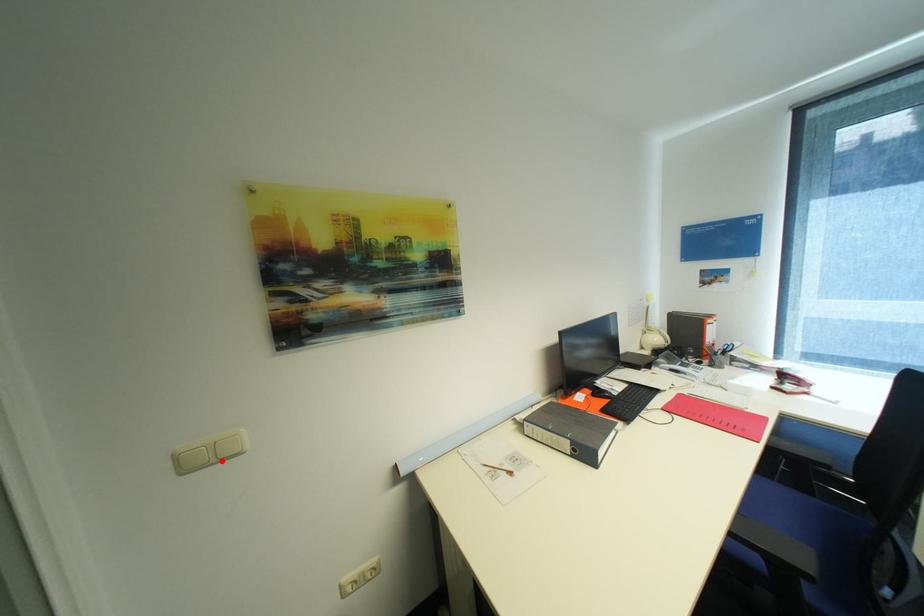
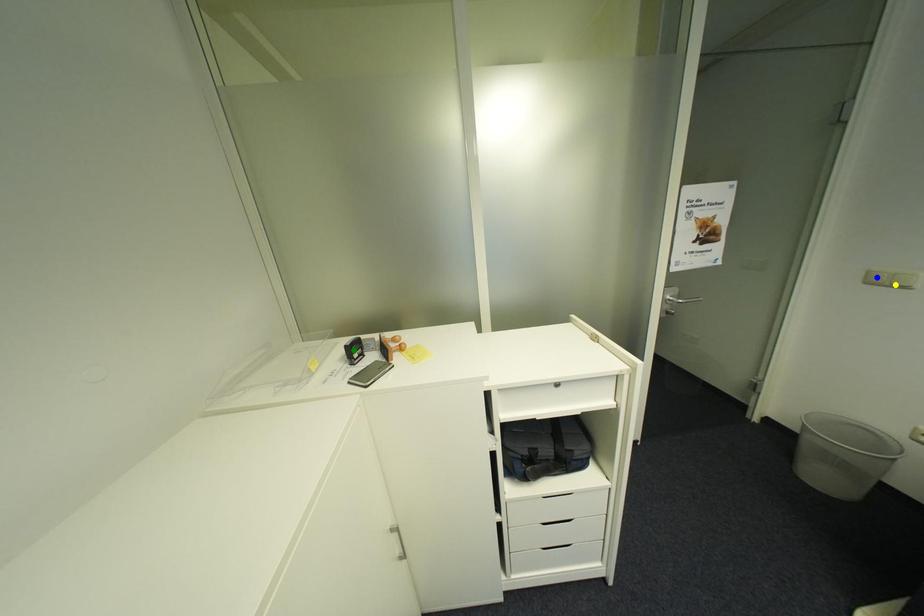
Question: I am providing you with two images of the same scene from different viewpoints. A red point is marked on the first image. You are given multiple points on the second image. Which point in image 2 is actually the same real-world point as the red point in image 1?

Choices:
 (A) blue point
 (B) yellow point
 (C) green point

Answer: (B)